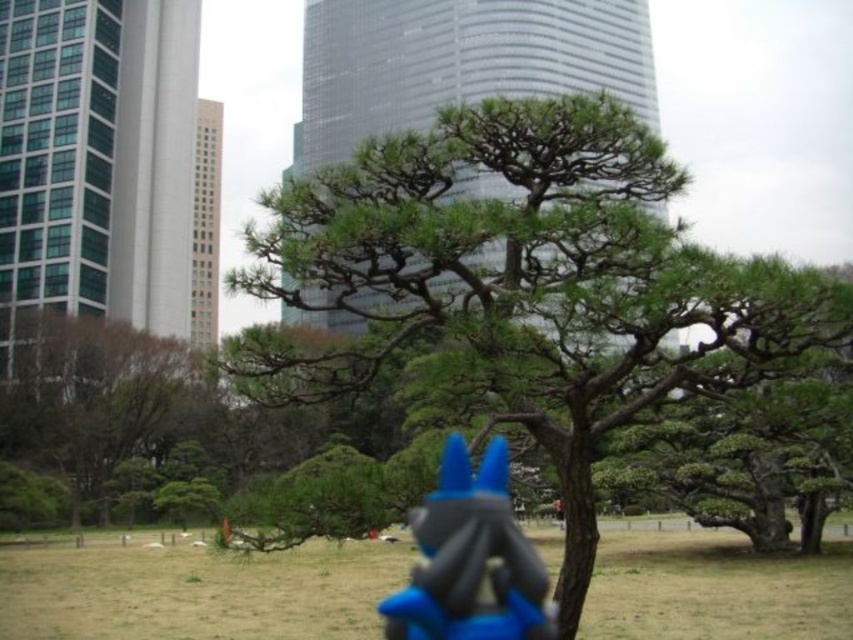
Question: Does green needle-like at center have a greater width compared to blue plastic toy at center?

Choices:
 (A) no
 (B) yes

Answer: (B)

Question: Which is nearer to the green needle-like at center?

Choices:
 (A) blue plastic toy at center
 (B) green leafy tree at left

Answer: (A)

Question: Which object is farther from the camera taking this photo?

Choices:
 (A) green leafy tree at left
 (B) green needle-like at center
 (C) blue plastic toy at center

Answer: (A)

Question: Considering the real-world distances, which object is farthest from the green leafy tree at left?

Choices:
 (A) green needle-like at center
 (B) blue plastic toy at center

Answer: (B)

Question: In this image, where is green needle-like at center located relative to blue plastic toy at center?

Choices:
 (A) above
 (B) below

Answer: (B)

Question: Is green needle-like at center to the left of blue plastic toy at center from the viewer's perspective?

Choices:
 (A) no
 (B) yes

Answer: (A)